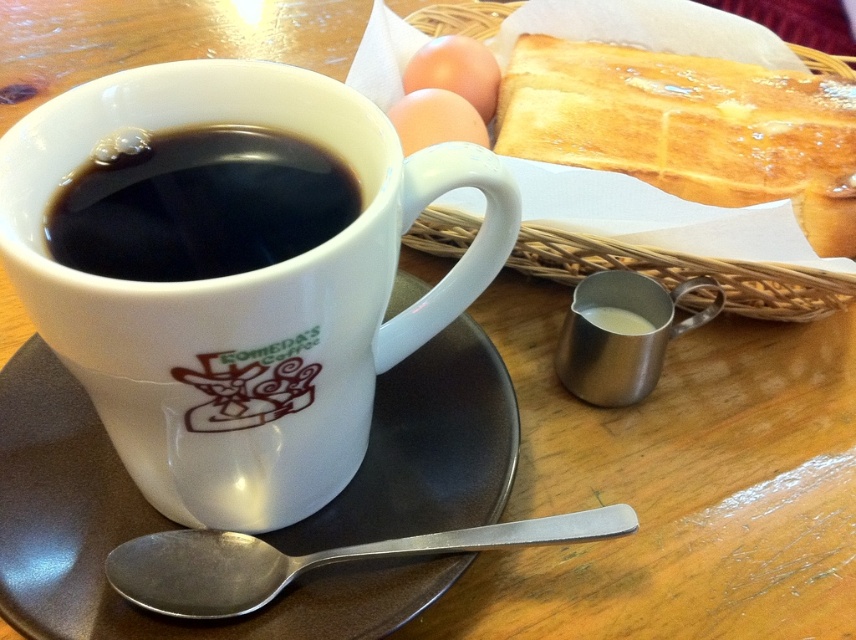
Can you confirm if golden brown toasted bread at upper right is positioned below matte brown egg at center?

Indeed, golden brown toasted bread at upper right is positioned under matte brown egg at center.

Is golden brown toasted bread at upper right positioned at the back of matte brown egg at center?

No, it is not.

Between point (539, 100) and point (474, 140), which one is positioned behind?

The point (539, 100) is more distant.

What are the coordinates of `golden brown toasted bread at upper right` in the screenshot? It's located at (688, 128).

Who is shorter, white ceramic mug at center or white ceramic saucer at lower center?

white ceramic saucer at lower center is shorter.

Does white ceramic mug at center have a lesser height compared to white ceramic saucer at lower center?

Incorrect, white ceramic mug at center's height does not fall short of white ceramic saucer at lower center's.

Does point (333, 371) come closer to viewer compared to point (342, 513)?

Yes.

This screenshot has height=640, width=856. What are the coordinates of `white ceramic mug at center` in the screenshot? It's located at (241, 285).

The width and height of the screenshot is (856, 640). Describe the element at coordinates (241, 285) in the screenshot. I see `white ceramic mug at center` at that location.

How far apart are white ceramic mug at center and golden brown toasted bread at upper right?

15.37 inches

Is point (93, 380) in front of point (716, 173)?

That is True.

Find the location of `white ceramic mug at center`. white ceramic mug at center is located at coordinates (241, 285).